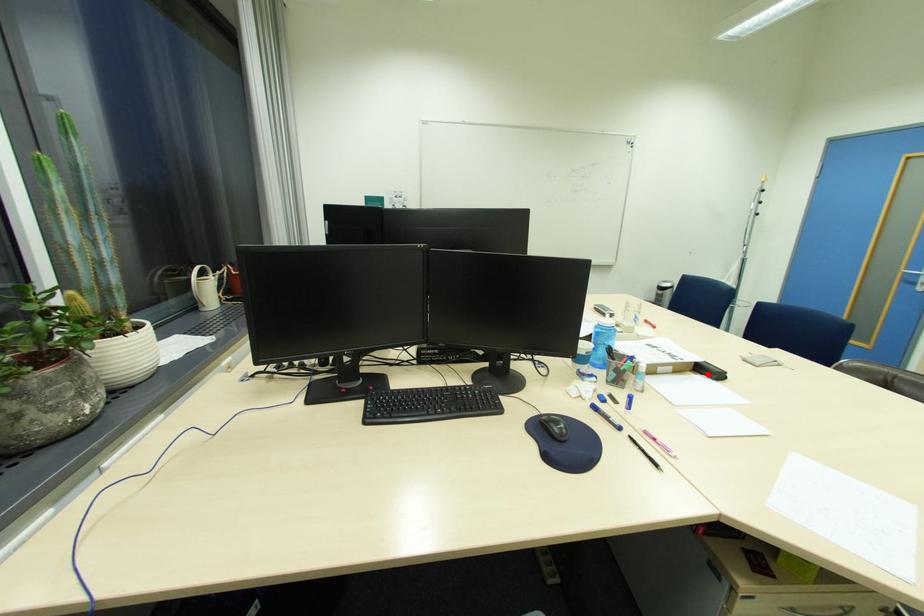
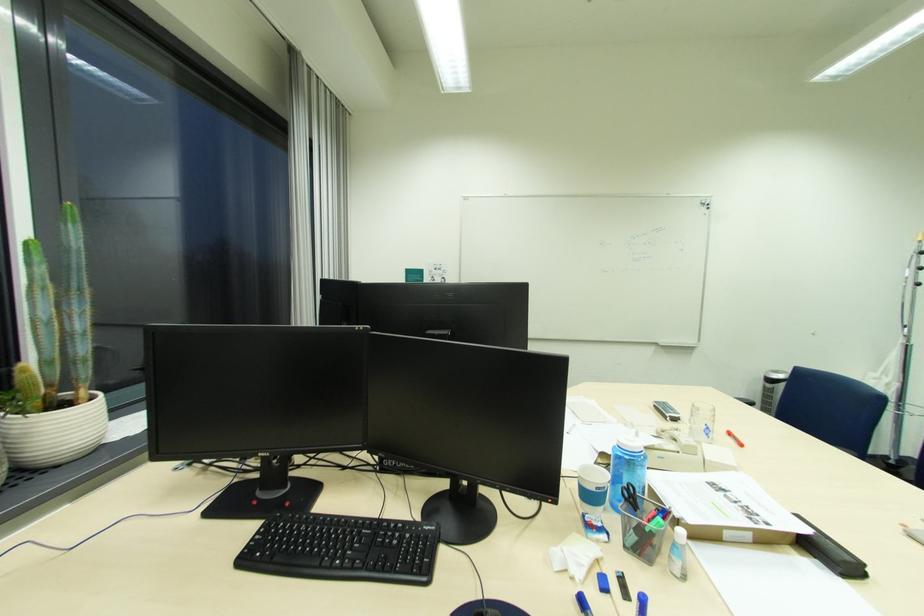
Locate, in the second image, the point that corresponds to the highlighted location in the first image.

(821, 557)